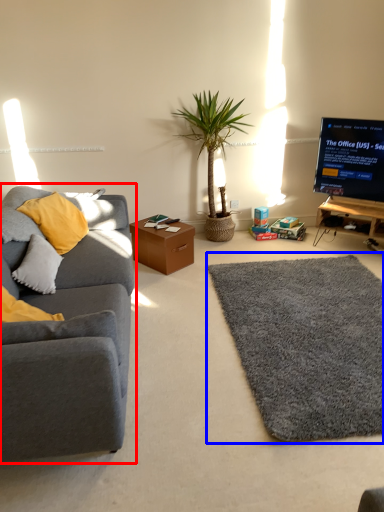
Question: Which of the following is the farthest to the observer, studio couch (highlighted by a red box) or mat (highlighted by a blue box)?

Choices:
 (A) studio couch
 (B) mat

Answer: (B)